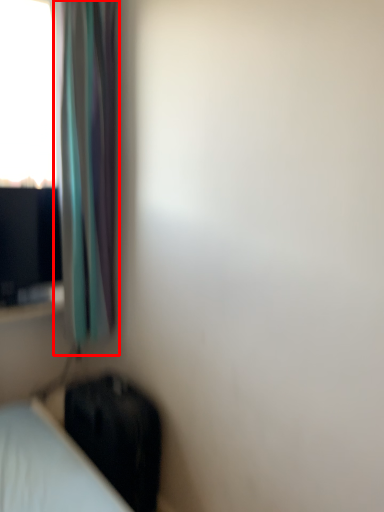
Question: From the image's perspective, what is the correct spatial positioning of curtain (annotated by the red box) in reference to luggage?

Choices:
 (A) below
 (B) above

Answer: (B)